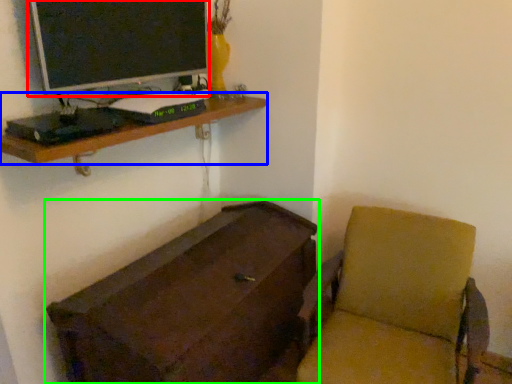
Question: Which object is positioned closest to computer monitor (highlighted by a red box)? Select from shelf (highlighted by a blue box) and furniture (highlighted by a green box).

Choices:
 (A) shelf
 (B) furniture

Answer: (A)